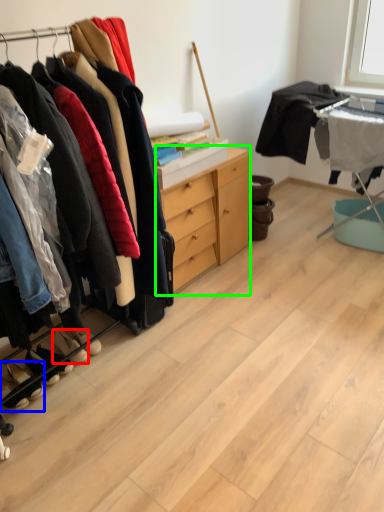
Question: Which object is positioned farthest from footwear (highlighted by a red box)? Select from footwear (highlighted by a blue box) and cabinetry (highlighted by a green box).

Choices:
 (A) footwear
 (B) cabinetry

Answer: (B)